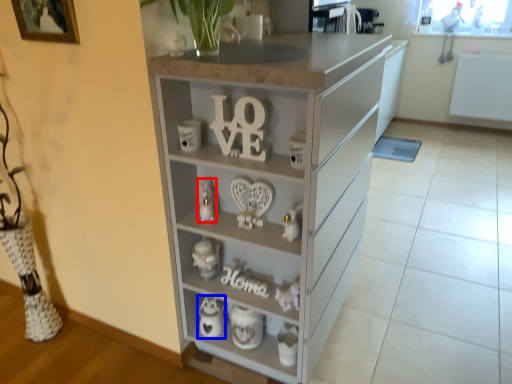
Question: Which point is further to the camera, toy (highlighted by a red box) or appliance (highlighted by a blue box)?

Choices:
 (A) toy
 (B) appliance

Answer: (B)